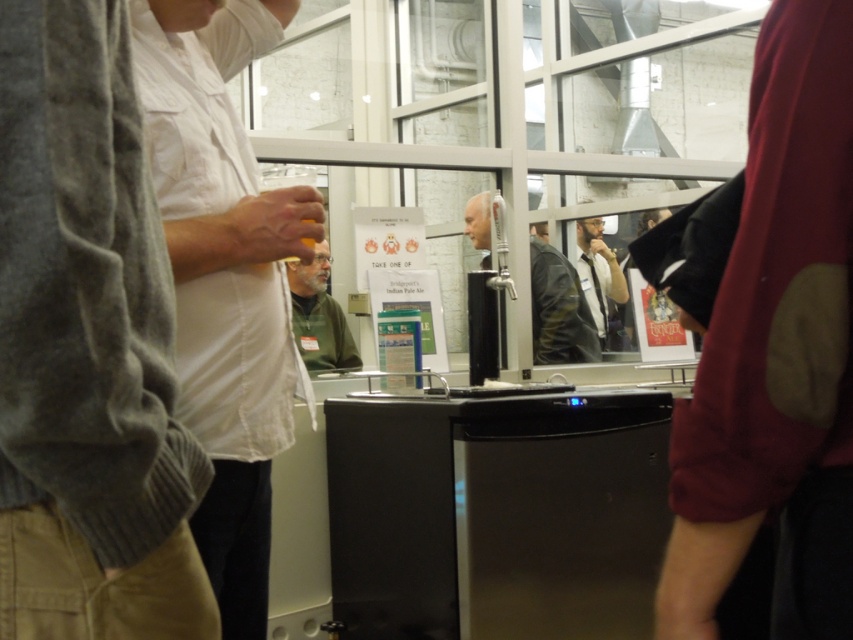
You are taking a photo at a beer tasting event and notice two points marked in the image. The first point is at coordinate point (311, 332) and the second at point (305, 240). Which point is closer to your camera?

Point (305, 240) is closer to the camera because it is less further than point (311, 332).

You are at a social gathering and want to know the spatial relationship between the knitted gray sweater at left and the green fabric jacket at center. Which one is lower in the image?

The knitted gray sweater at left is positioned under the green fabric jacket at center, so it is lower in the image.

You are at a beer tasting event and want to grab a drink. There is a green fabric jacket at center and a translucent glass beverage at center. Which one is closer to you?

The green fabric jacket at center is located below the translucent glass beverage at center, so the translucent glass beverage at center is closer to you.